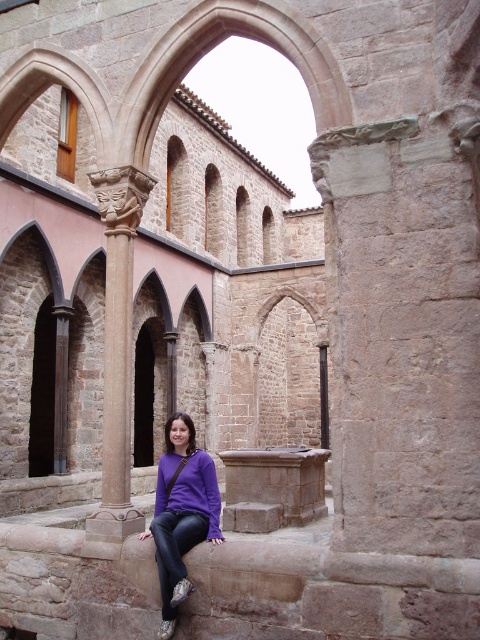
You are an interior designer planning to place a decorative item on the purple matte sweater at center. Considering the brown stone column at left, which object has a larger width that could affect placement?

The brown stone column at left is wider than the purple matte sweater at center, so placing the decorative item on the purple matte sweater at center may require considering the column for space.

You are standing in the historical stone structure and want to take a photo of the purple matte sweatshirt at lower center without including the brown stone column at left in the frame. Which direction should you move your camera to achieve this?

Move your camera to the right to exclude the brown stone column at left from the frame since it is positioned to the left of the purple matte sweatshirt at lower center.